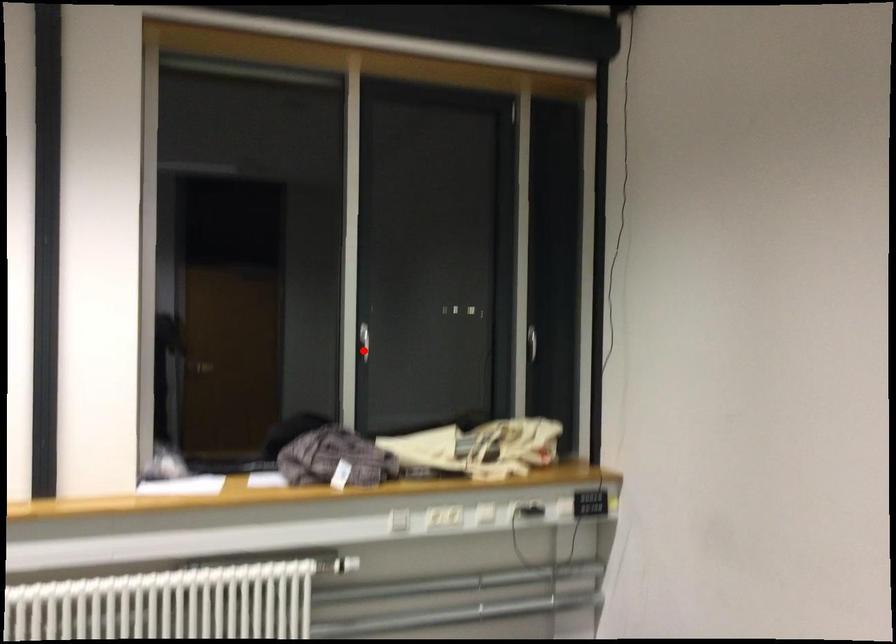
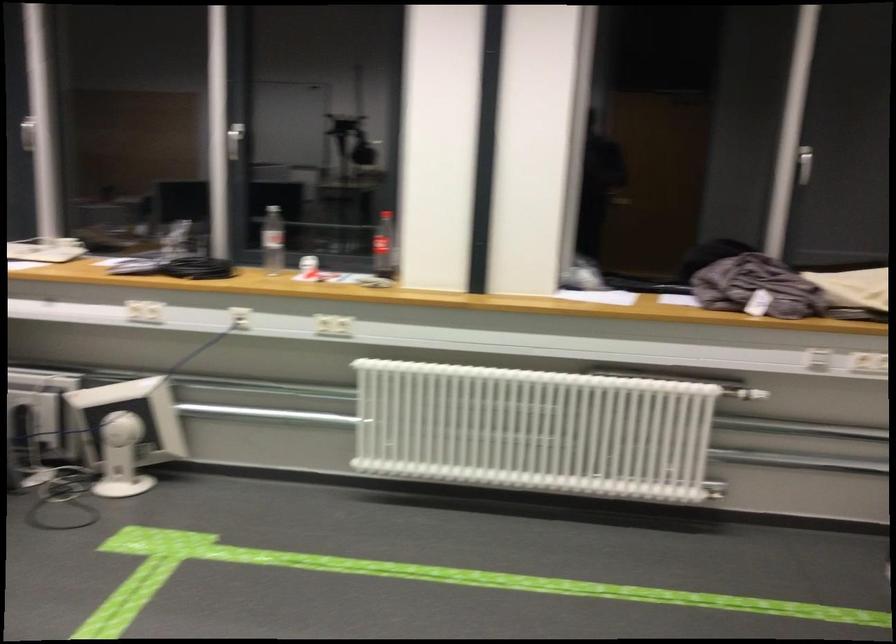
Question: I am providing you with two images of the same scene from different viewpoints. In image1, a red point is highlighted. Considering the same 3D point in image2, which of the following is correct?

Choices:
 (A) It is closer
 (B) It is farther

Answer: (A)